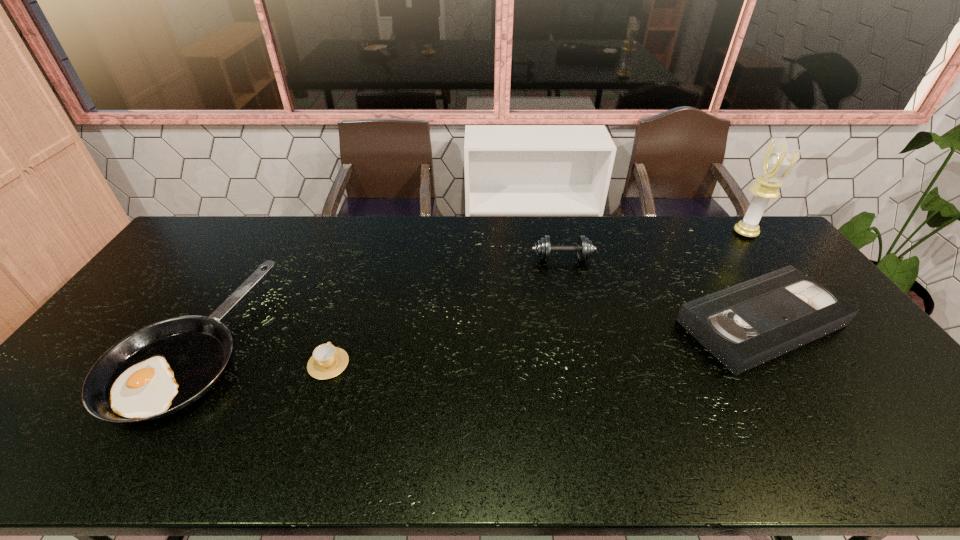
At what (x,y) coordinates should I click in order to perform the action: click on free space located on the front-facing side of the tallest object. Please return your answer as a coordinate pair (x, y). This screenshot has height=540, width=960. Looking at the image, I should click on (643, 233).

At what (x,y) coordinates should I click in order to perform the action: click on free location located 0.280m on the right of the fourth nearest object. Please return your answer as a coordinate pair (x, y). The width and height of the screenshot is (960, 540). Looking at the image, I should click on (676, 259).

At what (x,y) coordinates should I click in order to perform the action: click on free space located 0.050m on the right of the leftmost object. Please return your answer as a coordinate pair (x, y). Looking at the image, I should click on (268, 343).

The height and width of the screenshot is (540, 960). I want to click on free space located 0.060m on the left of the second shortest object, so click(x=657, y=322).

The height and width of the screenshot is (540, 960). Find the location of `free space located with the handle on the side of the shortest object`. free space located with the handle on the side of the shortest object is located at coordinates (351, 291).

This screenshot has height=540, width=960. Find the location of `vacant point located 0.400m with the handle on the side of the shortest object`. vacant point located 0.400m with the handle on the side of the shortest object is located at coordinates (363, 257).

Image resolution: width=960 pixels, height=540 pixels. Find the location of `vacant region located with the handle on the side of the shortest object`. vacant region located with the handle on the side of the shortest object is located at coordinates (345, 312).

You are a GUI agent. You are given a task and a screenshot of the screen. Output one action in this format:
    pyautogui.click(x=<x>, y=<y>)
    Task: Click on the award located at the far edge
    
    Given the screenshot: What is the action you would take?
    pyautogui.click(x=778, y=162)

Identify the location of dumbbell situated at the far edge. This screenshot has height=540, width=960. (584, 248).

What are the coordinates of `object that is at the near edge` in the screenshot? It's located at (162, 368).